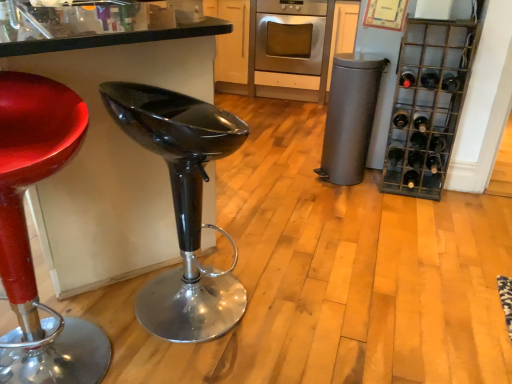
Consider the image. How much space does dark green glass bottle at right, which ranks as the 9th wine bottle in bottom-to-top order, occupy vertically?

The height of dark green glass bottle at right, which ranks as the 9th wine bottle in bottom-to-top order, is 2.44 inches.

What is the approximate width of black glass wine bottle at right, acting as the fifth wine bottle starting from the bottom?

black glass wine bottle at right, acting as the fifth wine bottle starting from the bottom, is 6.00 inches wide.

The height and width of the screenshot is (384, 512). What do you see at coordinates (428, 99) in the screenshot? I see `metallic wine rack at right` at bounding box center [428, 99].

Image resolution: width=512 pixels, height=384 pixels. What do you see at coordinates (400, 119) in the screenshot? I see `dark brown glass bottle at right, which is counted as the 4th wine bottle, starting from the top` at bounding box center [400, 119].

What do you see at coordinates (411, 178) in the screenshot? I see `black glass wine bottle at lower right, the 1th wine bottle from the bottom` at bounding box center [411, 178].

Locate an element on the screen. This screenshot has height=384, width=512. glossy black stool at left is located at coordinates (110, 150).

Is stainless steel oven at center turned away from dark green glass bottle at right, which ranks as the 9th wine bottle in bottom-to-top order?

No, stainless steel oven at center's orientation is not away from dark green glass bottle at right, which ranks as the 9th wine bottle in bottom-to-top order.

From the image's perspective, which is above, stainless steel oven at center or dark green glass bottle at right, positioned as the 2th wine bottle in top-to-bottom order?

From the image's view, stainless steel oven at center is above.

Does stainless steel oven at center have a greater width compared to dark green glass bottle at right, positioned as the 2th wine bottle in top-to-bottom order?

Indeed, stainless steel oven at center has a greater width compared to dark green glass bottle at right, positioned as the 2th wine bottle in top-to-bottom order.

Identify the location of the 6th wine bottle to the right of the stainless steel oven at center, starting your count from the anchor. This screenshot has height=384, width=512. (430, 79).

How different are the orientations of dark green glass bottle at right, positioned as the 2th wine bottle in top-to-bottom order, and shiny red stool at left in degrees?

They differ by 47.9 degrees in their facing directions.

Which object is thinner, dark green glass bottle at right, positioned as the 2th wine bottle in top-to-bottom order, or shiny red stool at left?

dark green glass bottle at right, positioned as the 2th wine bottle in top-to-bottom order, is thinner.

Considering the points (437, 84) and (5, 77), which point is behind, point (437, 84) or point (5, 77)?

Point (437, 84)

From the image's perspective, is dark green glass bottle at right, which ranks as the 9th wine bottle in bottom-to-top order, under shiny red stool at left?

No, from the image's perspective, dark green glass bottle at right, which ranks as the 9th wine bottle in bottom-to-top order, is not beneath shiny red stool at left.

Considering the relative sizes of dark brown glass bottle at right, which is the seventh wine bottle from bottom to top, and dark brown glass bottle at right, which is the second wine bottle from bottom to top, in the image provided, is dark brown glass bottle at right, which is the seventh wine bottle from bottom to top, taller than dark brown glass bottle at right, which is the second wine bottle from bottom to top,?

No.

Starting from the dark brown glass bottle at right, the 9th wine bottle from the top, which wine bottle is the 1st one behind? Please provide its 2D coordinates.

[(400, 119)]

In the scene shown: From a real-world perspective, is dark brown glass bottle at right, which is counted as the 4th wine bottle, starting from the top, under dark brown glass bottle at right, which is the second wine bottle from bottom to top?

No, from a real-world perspective, dark brown glass bottle at right, which is counted as the 4th wine bottle, starting from the top, is not under dark brown glass bottle at right, which is the second wine bottle from bottom to top.

Can you confirm if shiny red stool at left is wider than dark glass wine bottle at right, which is the 6th wine bottle in bottom-to-top order?

Correct, the width of shiny red stool at left exceeds that of dark glass wine bottle at right, which is the 6th wine bottle in bottom-to-top order.

Considering the relative positions of shiny red stool at left and dark glass wine bottle at right, the 5th wine bottle viewed from the top, in the image provided, is shiny red stool at left to the right of dark glass wine bottle at right, the 5th wine bottle viewed from the top, from the viewer's perspective?

No.

Would you say shiny red stool at left is outside dark glass wine bottle at right, the 5th wine bottle viewed from the top?

Absolutely, shiny red stool at left is external to dark glass wine bottle at right, the 5th wine bottle viewed from the top.

How many degrees apart are the facing directions of shiny red stool at left and dark glass wine bottle at right, the 5th wine bottle viewed from the top?

The facing directions of shiny red stool at left and dark glass wine bottle at right, the 5th wine bottle viewed from the top, are 48.1 degrees apart.

From a real-world perspective, is gray matte trash can at center-right located beneath glossy black stool at center?

Yes, from a real-world perspective, gray matte trash can at center-right is beneath glossy black stool at center.

Could you tell me if gray matte trash can at center-right is turned towards glossy black stool at center?

Yes, gray matte trash can at center-right faces towards glossy black stool at center.

Considering the relative positions of gray matte trash can at center-right and glossy black stool at center in the image provided, is gray matte trash can at center-right to the left of glossy black stool at center from the viewer's perspective?

In fact, gray matte trash can at center-right is to the right of glossy black stool at center.

Looking at their sizes, would you say gray matte trash can at center-right is wider or thinner than glossy black stool at center?

Considering their sizes, gray matte trash can at center-right looks slimmer than glossy black stool at center.

Does black glass bottle at right, positioned as the 8th wine bottle in top-to-bottom order, touch black glass wine bottle at lower right, the 1th wine bottle from the bottom?

Yes, black glass bottle at right, positioned as the 8th wine bottle in top-to-bottom order, is right next to black glass wine bottle at lower right, the 1th wine bottle from the bottom, and making contact.

Can you tell me how much black glass bottle at right, positioned as the third wine bottle in bottom-to-top order, and black glass wine bottle at lower right, the tenth wine bottle when ordered from top to bottom, differ in facing direction?

The angular difference between black glass bottle at right, positioned as the third wine bottle in bottom-to-top order, and black glass wine bottle at lower right, the tenth wine bottle when ordered from top to bottom, is 2.31e-05 degrees.

Consider the image. Does black glass bottle at right, positioned as the 8th wine bottle in top-to-bottom order, have a lesser height compared to black glass wine bottle at lower right, the tenth wine bottle when ordered from top to bottom?

Indeed, black glass bottle at right, positioned as the 8th wine bottle in top-to-bottom order, has a lesser height compared to black glass wine bottle at lower right, the tenth wine bottle when ordered from top to bottom.

From the image's perspective, is black glass bottle at right, positioned as the third wine bottle in bottom-to-top order, over black glass wine bottle at lower right, the tenth wine bottle when ordered from top to bottom?

Yes.

Would you say dark brown glass bottle at right, which is the second wine bottle from bottom to top, contains gray matte trash can at center-right?

No.

Is dark brown glass bottle at right, the 9th wine bottle from the top, with gray matte trash can at center-right?

They are not placed beside each other.

Considering the positions of objects dark brown glass bottle at right, the 9th wine bottle from the top, and gray matte trash can at center-right in the image provided, who is more to the left, dark brown glass bottle at right, the 9th wine bottle from the top, or gray matte trash can at center-right?

From the viewer's perspective, gray matte trash can at center-right appears more on the left side.

Is dark brown glass bottle at right, which is the second wine bottle from bottom to top, turned away from gray matte trash can at center-right?

No, dark brown glass bottle at right, which is the second wine bottle from bottom to top,'s orientation is not away from gray matte trash can at center-right.

This screenshot has width=512, height=384. Find the location of `the 2nd wine bottle positioned below the stainless steel oven at center (from the image's perspective)`. the 2nd wine bottle positioned below the stainless steel oven at center (from the image's perspective) is located at coordinates (430, 79).

From a real-world perspective, count 3rd wine bottles upward from the shiny red stool at left and point to it. Please provide its 2D coordinates.

[(430, 79)]

Considering their positions, is dark brown glass bottle at right, placed as the fourth wine bottle when sorted from bottom to top, positioned further to black glass wine bottle at lower right, the tenth wine bottle when ordered from top to bottom, than metallic wine rack at right?

The object further to black glass wine bottle at lower right, the tenth wine bottle when ordered from top to bottom, is metallic wine rack at right.

Considering their positions, is black glass wine bottle at lower right, the tenth wine bottle when ordered from top to bottom, positioned closer to stainless steel oven at center than dark brown glass bottle at right, which is counted as the 4th wine bottle, starting from the top?

dark brown glass bottle at right, which is counted as the 4th wine bottle, starting from the top, is positioned closer to the anchor stainless steel oven at center.

When comparing their distances from black glass wine bottle at right, acting as the fifth wine bottle starting from the bottom, does dark brown glass bottle at right, which is the seventh wine bottle from bottom to top, or metallic wine rack at right seem further?

metallic wine rack at right lies further to black glass wine bottle at right, acting as the fifth wine bottle starting from the bottom, than the other object.

When comparing their distances from black glass bottle at right, positioned as the 8th wine bottle in top-to-bottom order, does stainless steel oven at center or black glass wine bottle at lower right, the tenth wine bottle when ordered from top to bottom, seem further?

stainless steel oven at center.

Considering their positions, is dark brown glass bottle at right, which is the second wine bottle from bottom to top, positioned further to gray matte trash can at center-right than dark red glass bottle at right, which is counted as the 10th wine bottle, starting from the bottom?

dark brown glass bottle at right, which is the second wine bottle from bottom to top, is further to gray matte trash can at center-right.

Based on the photo, from the image, which object appears to be farther from gray matte trash can at center-right, metallic wine rack at right or stainless steel oven at center?

stainless steel oven at center is further to gray matte trash can at center-right.

Which object lies nearer to the anchor point dark brown glass bottle at right, the seventh wine bottle viewed from the top, metallic wine rack at right or stainless steel oven at center?

metallic wine rack at right.

When comparing their distances from dark brown glass bottle at right, which is counted as the 4th wine bottle, starting from the top, does glossy black stool at center or dark green glass bottle at right, which ranks as the 9th wine bottle in bottom-to-top order, seem further?

Among the two, glossy black stool at center is located further to dark brown glass bottle at right, which is counted as the 4th wine bottle, starting from the top.

This screenshot has height=384, width=512. What are the coordinates of `appliance between glossy black stool at left and dark brown glass bottle at right, placed as the fourth wine bottle when sorted from bottom to top, in the horizontal direction` in the screenshot? It's located at (350, 116).

Find the location of `furniture located between shiny red stool at left and metallic wine rack at right in the left-right direction`. furniture located between shiny red stool at left and metallic wine rack at right in the left-right direction is located at coordinates (183, 206).

Identify the location of wine rack between glossy black stool at center and dark glass wine bottle at right, which is the 6th wine bottle in bottom-to-top order, in the front-back direction. (428, 99).

Image resolution: width=512 pixels, height=384 pixels. In order to click on wine rack that lies between dark red glass bottle at right, which is the 1th wine bottle from top to bottom, and dark brown glass bottle at right, the seventh wine bottle viewed from the top, from top to bottom in this screenshot , I will do `click(428, 99)`.